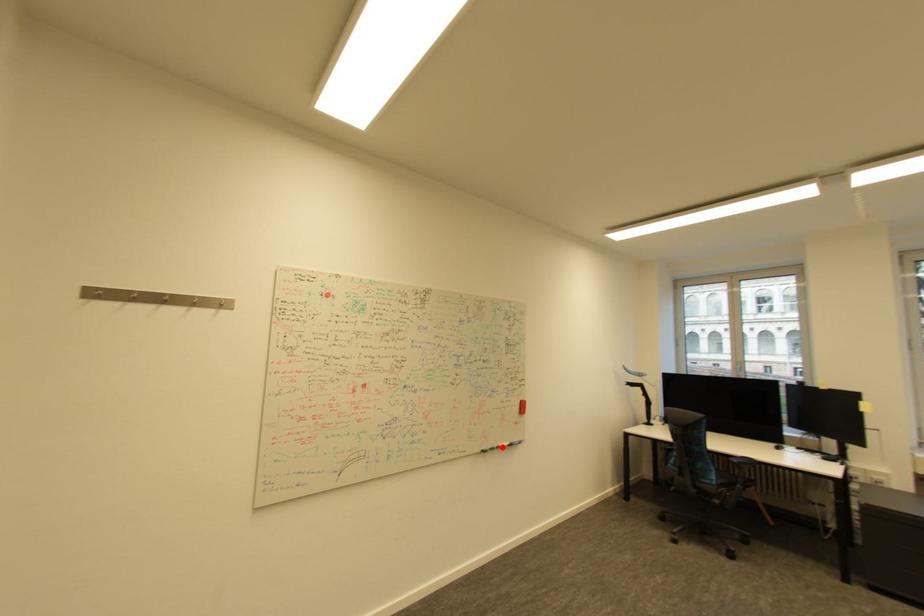
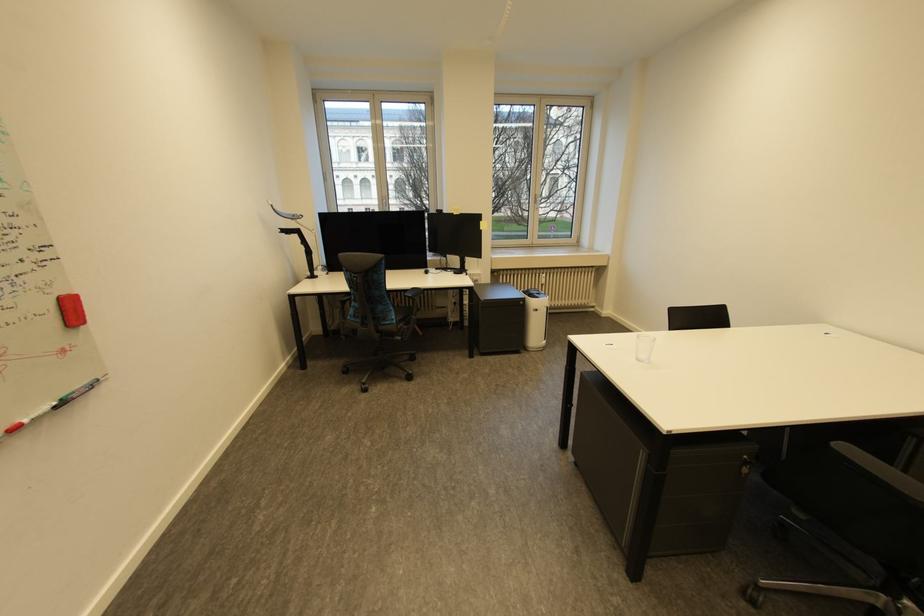
Find the pixel in the second image that matches the highlighted location in the first image.

(6, 436)